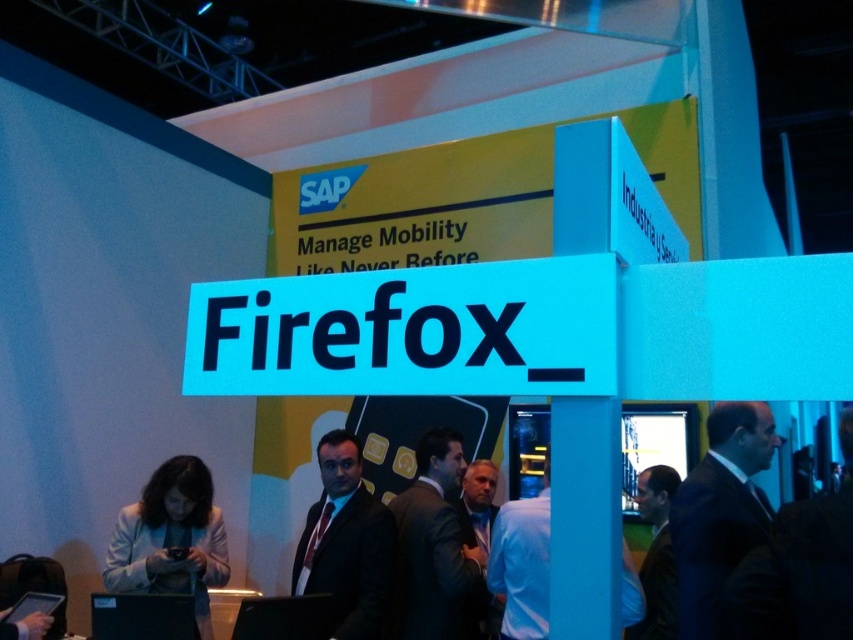
You are a security guard at the exhibition and need to check both the dark blue suit at center and the light beige blazer at lower left. If your reach is 1.8 meters, can you check both without moving?

The dark blue suit at center and light beige blazer at lower left are 1.86 meters apart, so you cannot check both without moving as the distance exceeds your reach of 1.8 meters.

You are at a trade show and see two suits at the center of the booth. The first is a dark blue suit at center and the second is a dark suit at center. Which one is positioned higher?

The dark blue suit at center is located above the dark suit at center.